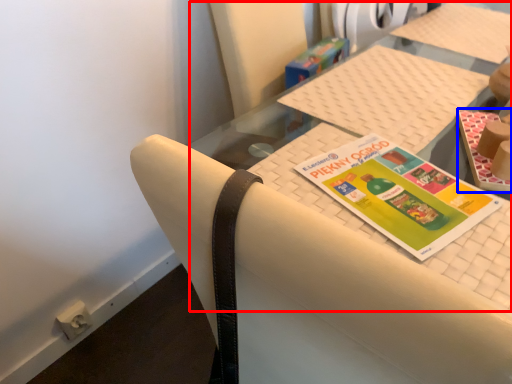
Question: Among these objects, which one is nearest to the camera, tablecloth (highlighted by a red box) or book (highlighted by a blue box)?

Choices:
 (A) tablecloth
 (B) book

Answer: (A)